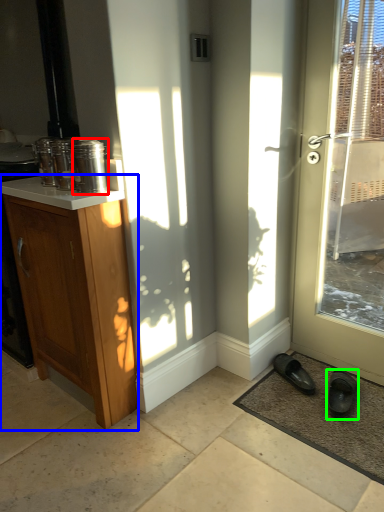
Question: Estimate the real-world distances between objects in this image. Which object is farther from glass jar (highlighted by a red box), cabinetry (highlighted by a blue box) or footwear (highlighted by a green box)?

Choices:
 (A) cabinetry
 (B) footwear

Answer: (B)